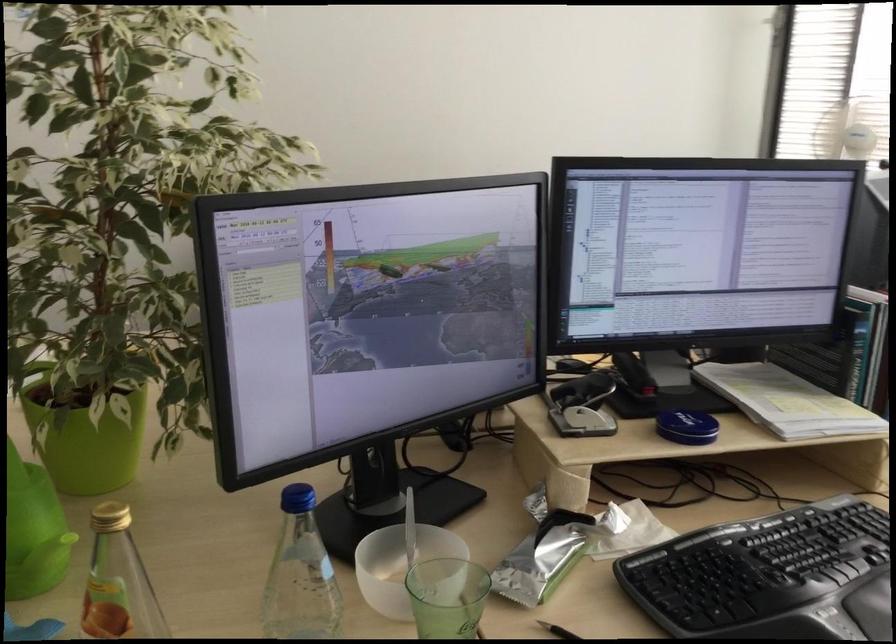
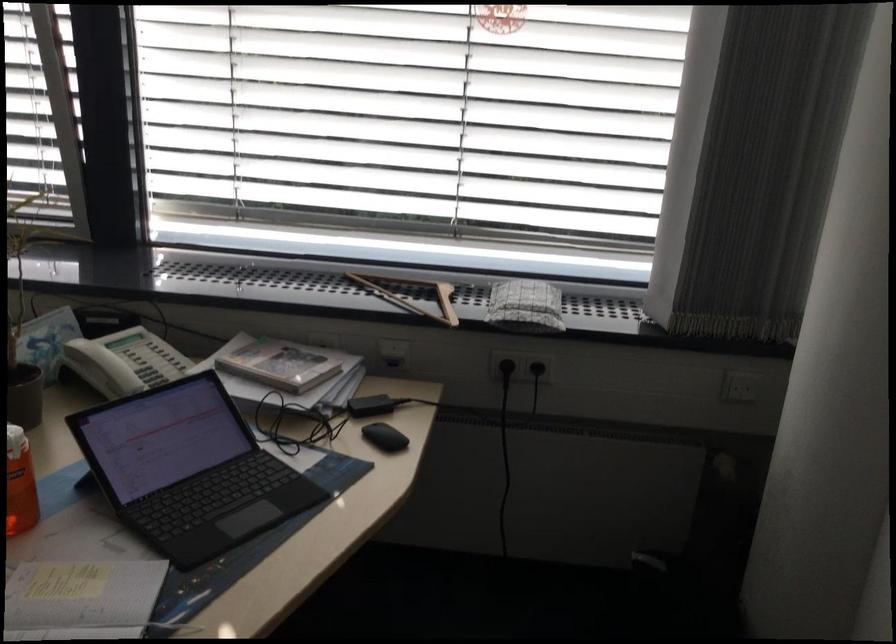
Consider the image. Based on the continuous images, in which direction is the camera rotating?

The camera rotated toward right-down.